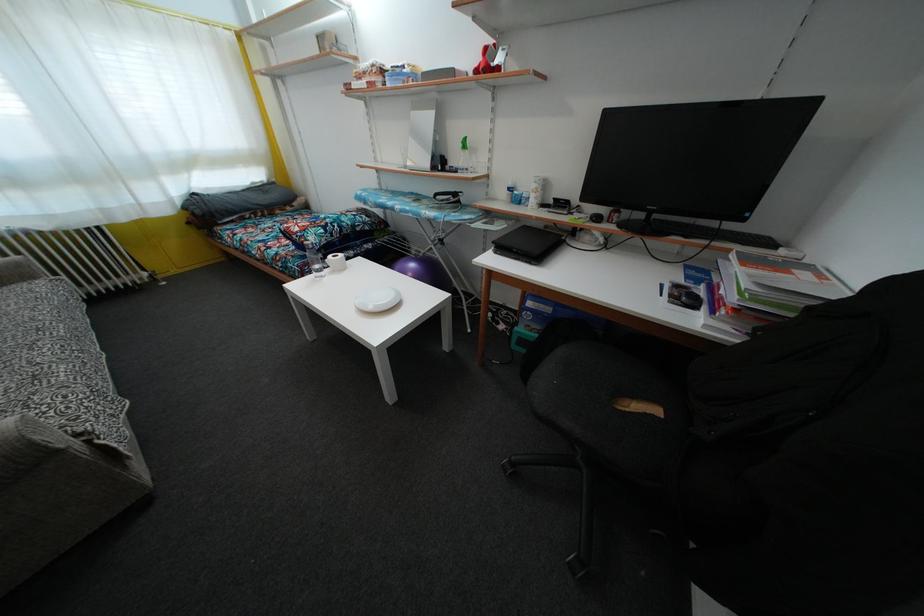
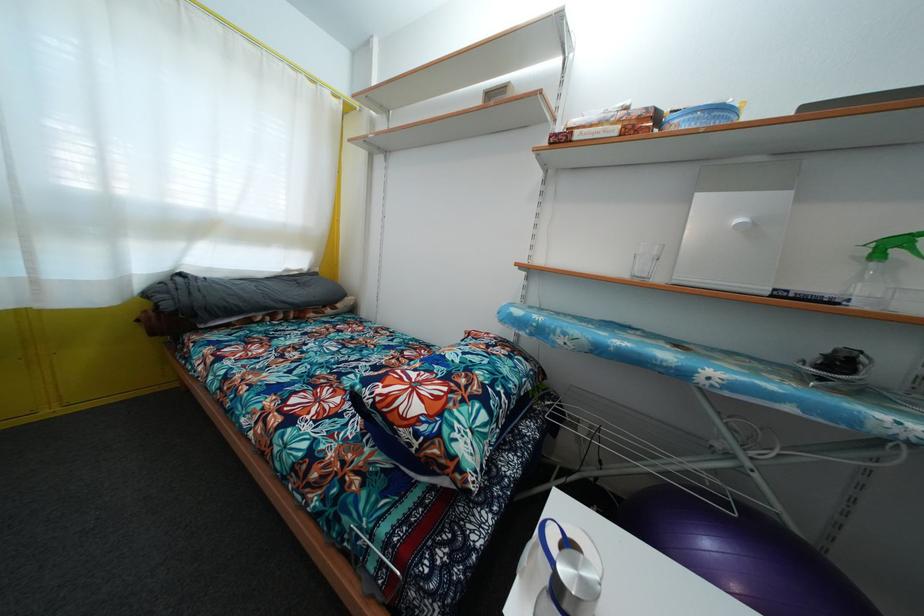
Which direction would the cameraman need to move to produce the second image?

The cameraman moved toward left, forward.